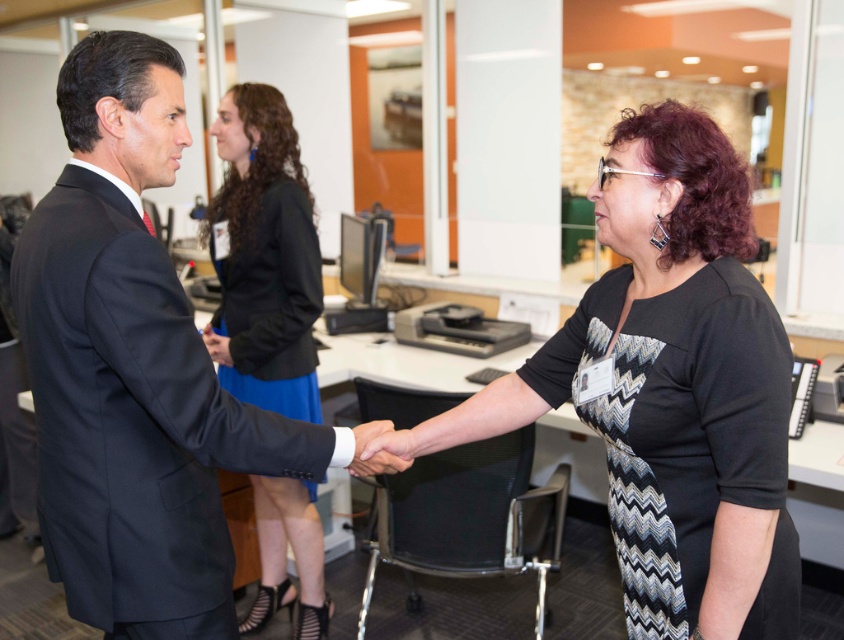
Is the position of blue satin skirt at center less distant than that of smooth skin handshake at center?

No, blue satin skirt at center is further to the viewer.

Which is above, blue satin skirt at center or smooth skin handshake at center?

Positioned higher is blue satin skirt at center.

Is point (288, 387) positioned before point (406, 467)?

No, it is not.

Identify the location of blue satin skirt at center. Image resolution: width=844 pixels, height=640 pixels. (264, 256).

Does shiny black suit at center have a smaller size compared to black zigzag-patterned dress at center?

Correct, shiny black suit at center occupies less space than black zigzag-patterned dress at center.

Can you confirm if shiny black suit at center is bigger than black zigzag-patterned dress at center?

No, shiny black suit at center is not bigger than black zigzag-patterned dress at center.

What do you see at coordinates (133, 369) in the screenshot?
I see `shiny black suit at center` at bounding box center [133, 369].

The height and width of the screenshot is (640, 844). Identify the location of shiny black suit at center. (133, 369).

Is smooth skin handshake at center bigger than matte black hand at center?

No.

Who is more distant from viewer, (366, 436) or (222, 340)?

Point (222, 340)

The width and height of the screenshot is (844, 640). What are the coordinates of `smooth skin handshake at center` in the screenshot? It's located at (374, 451).